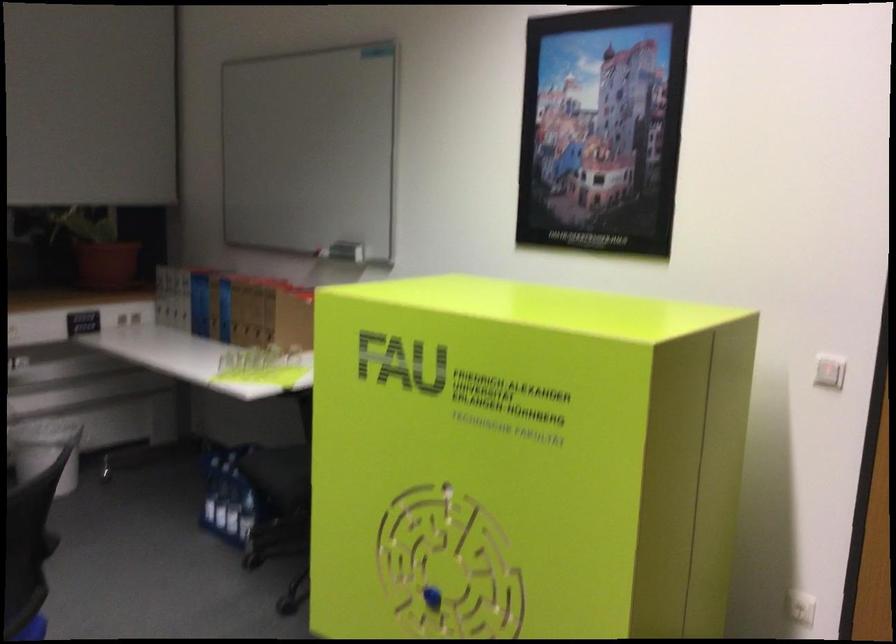
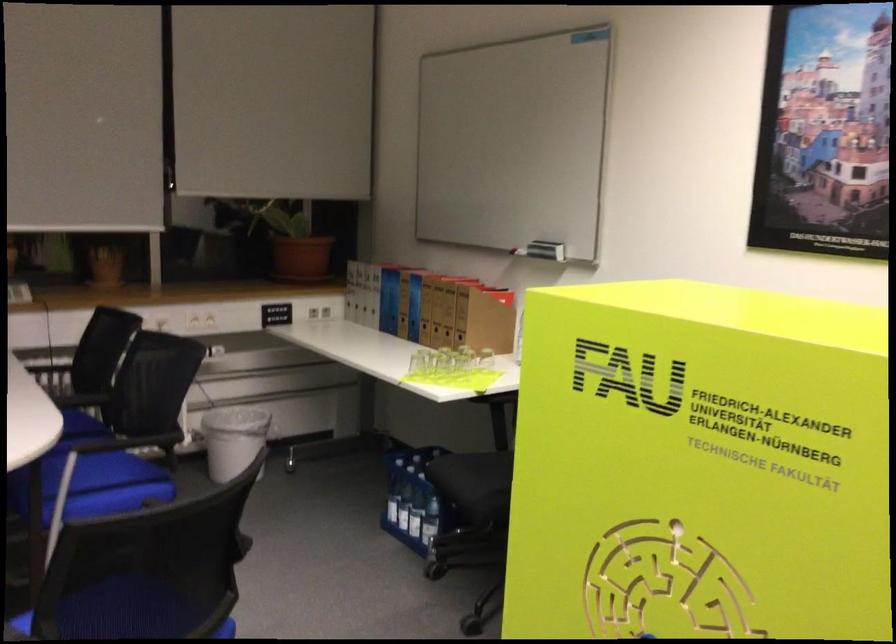
Where in the second image is the point corresponding to the point at 224,502 from the first image?

(403, 507)